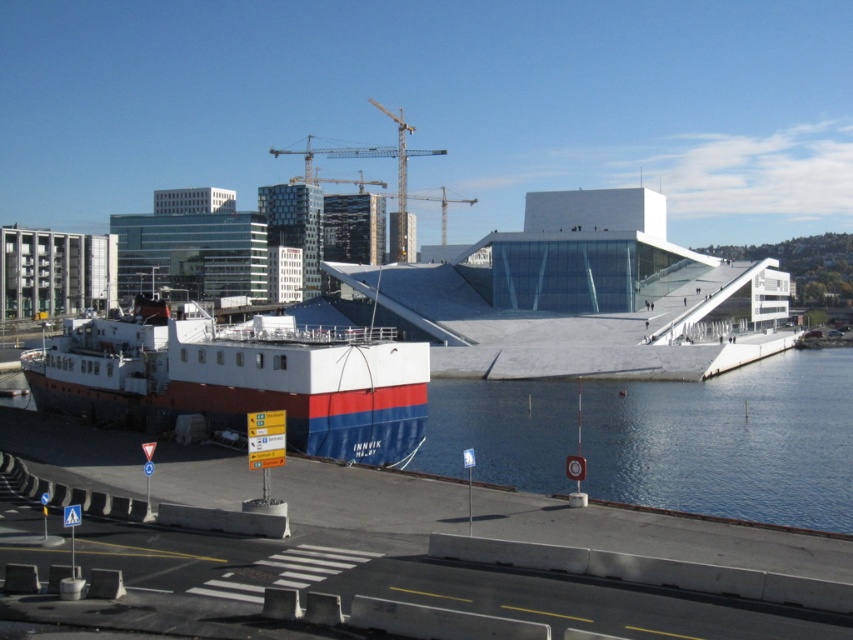
Question: Considering the real-world distances, which object is closest to the clear blue water at center?

Choices:
 (A) metallic yellow crane at upper center
 (B) white matte boat at lower left

Answer: (B)

Question: Does clear blue water at center appear under metallic yellow crane at upper center?

Choices:
 (A) no
 (B) yes

Answer: (B)

Question: From the image, what is the correct spatial relationship of clear blue water at center in relation to metallic yellow crane at upper center?

Choices:
 (A) left
 (B) right

Answer: (B)

Question: Which of the following is the closest to the observer?

Choices:
 (A) white matte boat at lower left
 (B) clear blue water at center
 (C) metallic yellow crane at upper center

Answer: (B)

Question: Does white matte boat at lower left have a greater width compared to metallic yellow crane at upper center?

Choices:
 (A) yes
 (B) no

Answer: (B)

Question: Which object appears closest to the camera in this image?

Choices:
 (A) metallic yellow crane at upper center
 (B) clear blue water at center
 (C) white matte boat at lower left

Answer: (B)